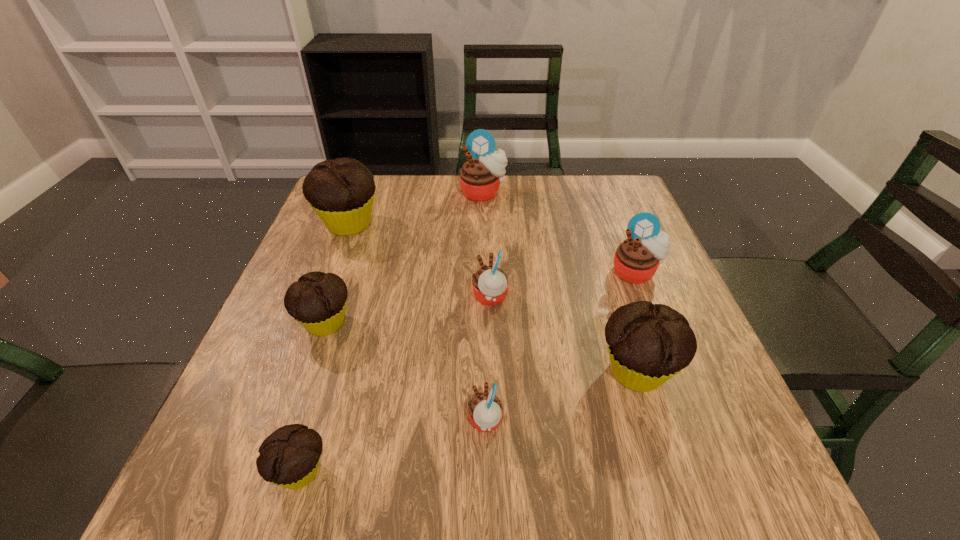
The image size is (960, 540). What are the coordinates of `free location located on the front-facing side of the nearest pink muffin` in the screenshot? It's located at (367, 421).

Identify the location of vacant space located on the front-facing side of the nearest pink muffin. (432, 421).

The height and width of the screenshot is (540, 960). In order to click on vacant space situated on the back of the smallest chocolate muffin in this screenshot , I will do `click(326, 386)`.

Where is `object located in the near edge section of the desktop`? Image resolution: width=960 pixels, height=540 pixels. object located in the near edge section of the desktop is located at coordinates (289, 457).

The image size is (960, 540). What are the coordinates of `object that is at the far left corner` in the screenshot? It's located at (341, 191).

Where is `object located in the near left corner section of the desktop`? The height and width of the screenshot is (540, 960). object located in the near left corner section of the desktop is located at coordinates (289, 457).

Locate an element on the screen. free space at the far edge of the desktop is located at coordinates (530, 179).

At what (x,y) coordinates should I click in order to perform the action: click on free spot at the left edge of the desktop. Please return your answer as a coordinate pair (x, y). The image size is (960, 540). Looking at the image, I should click on (313, 246).

Where is `free space at the right edge of the desktop`? The width and height of the screenshot is (960, 540). free space at the right edge of the desktop is located at coordinates coord(595,224).

Find the location of a particular element. The height and width of the screenshot is (540, 960). free space at the far left corner of the desktop is located at coordinates (378, 181).